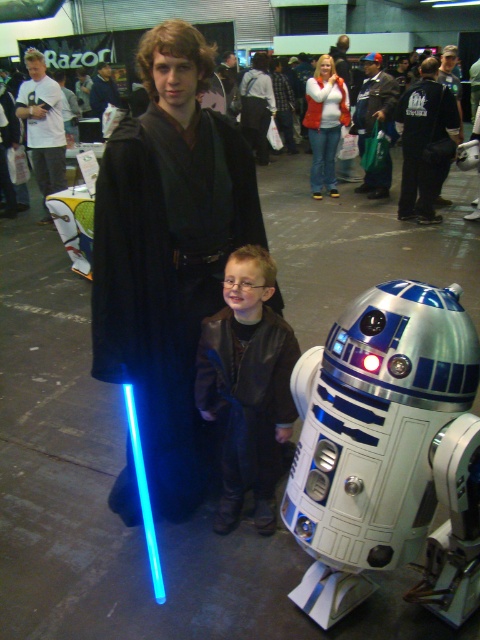
Who is lower down, white t-shirt at upper left or dark blue jeans at center?

white t-shirt at upper left

Is white t-shirt at upper left taller than dark blue jeans at center?

Indeed, white t-shirt at upper left has a greater height compared to dark blue jeans at center.

Describe the element at coordinates (43, 125) in the screenshot. The height and width of the screenshot is (640, 480). I see `white t-shirt at upper left` at that location.

Where is `white t-shirt at upper left`? The image size is (480, 640). white t-shirt at upper left is located at coordinates (43, 125).

Based on the photo, can you confirm if black fabric jacket at upper center is smaller than smooth black robe at center?

Indeed, black fabric jacket at upper center has a smaller size compared to smooth black robe at center.

Who is shorter, black fabric jacket at upper center or smooth black robe at center?

With less height is smooth black robe at center.

The image size is (480, 640). In order to click on black fabric jacket at upper center in this screenshot , I will do `click(424, 141)`.

Can you confirm if white t-shirt at upper left is positioned to the left of smooth black robe at center?

No, white t-shirt at upper left is not to the left of smooth black robe at center.

Is white t-shirt at upper left shorter than smooth black robe at center?

No, white t-shirt at upper left is not shorter than smooth black robe at center.

Who is more distant from viewer, (60, 179) or (107, 72)?

Point (107, 72)

Where is `white t-shirt at upper left`? Image resolution: width=480 pixels, height=640 pixels. white t-shirt at upper left is located at coordinates (43, 125).